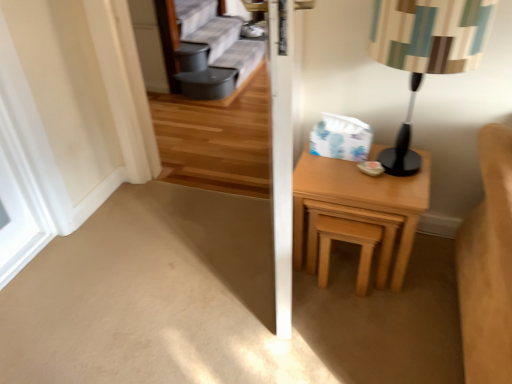
Find the location of a particular element. The width and height of the screenshot is (512, 384). vacant region to the left of light wood/texture nightstand at right is located at coordinates (251, 262).